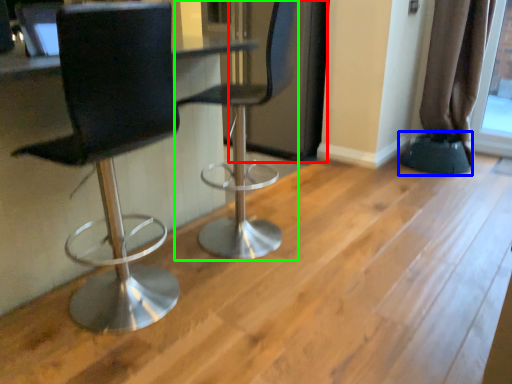
Question: Which object is positioned closest to screen door (highlighted by a red box)? Select from step stool (highlighted by a blue box) and chair (highlighted by a green box).

Choices:
 (A) step stool
 (B) chair

Answer: (B)